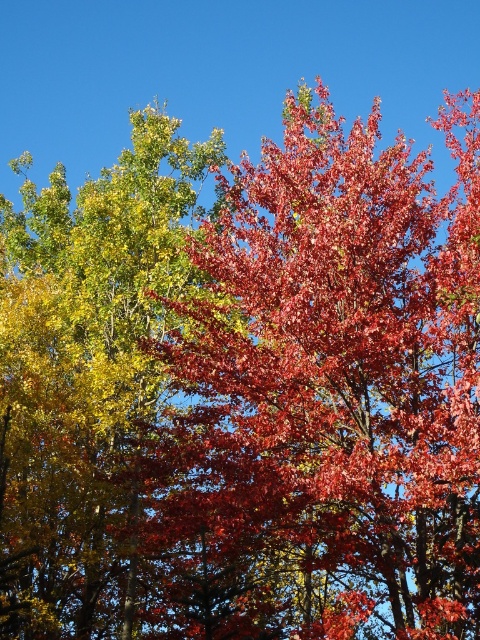
Which is more to the right, shiny red leaves at center or shiny green leaves at upper left?

Positioned to the right is shiny red leaves at center.

Who is more forward, (340,188) or (64,253)?

Point (340,188) is more forward.

Who is more distant from viewer, (409,220) or (90,358)?

The point (90,358) is behind.

You are a GUI agent. You are given a task and a screenshot of the screen. Output one action in this format:
    pyautogui.click(x=<x>, y=<y>)
    Task: Click on the shiny red leaves at center
    The width and height of the screenshot is (480, 640).
    Given the screenshot: What is the action you would take?
    pyautogui.click(x=324, y=396)